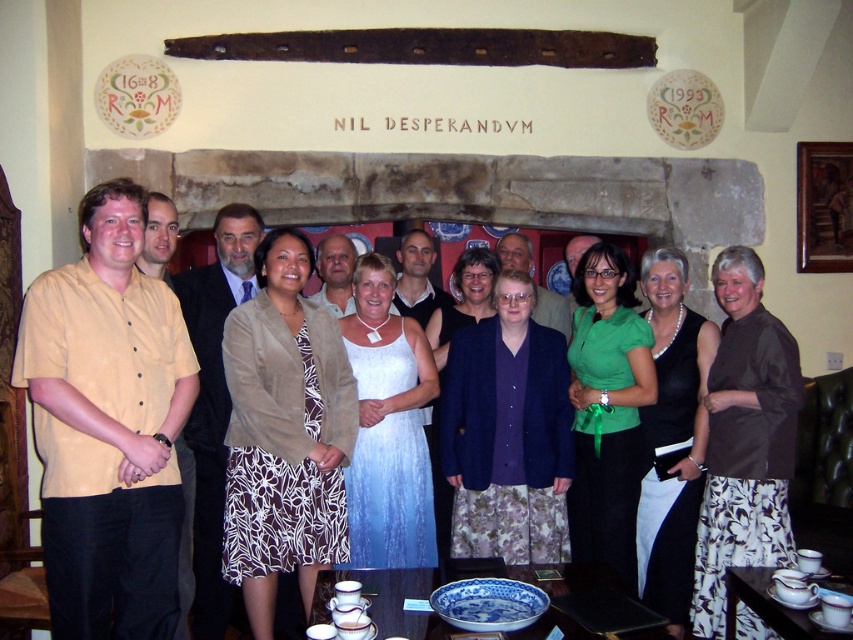
Question: Among these points, which one is farthest from the camera?

Choices:
 (A) (390, 428)
 (B) (535, 451)

Answer: (A)

Question: Which object appears farthest from the camera in this image?

Choices:
 (A) matte purple sweater at center
 (B) green matte shirt at center

Answer: (A)

Question: Which of the following is the farthest from the observer?

Choices:
 (A) beige suede blazer at center
 (B) matte purple sweater at center
 (C) dark blue textured cardigan at center

Answer: (B)

Question: Is beige suede blazer at center closer to camera compared to white satin dress at center?

Choices:
 (A) yes
 (B) no

Answer: (A)

Question: Can you confirm if matte beige blazer at center is positioned above dark blue textured cardigan at center?

Choices:
 (A) yes
 (B) no

Answer: (A)

Question: Is matte beige blazer at center to the left of matte purple sweater at center from the viewer's perspective?

Choices:
 (A) no
 (B) yes

Answer: (A)